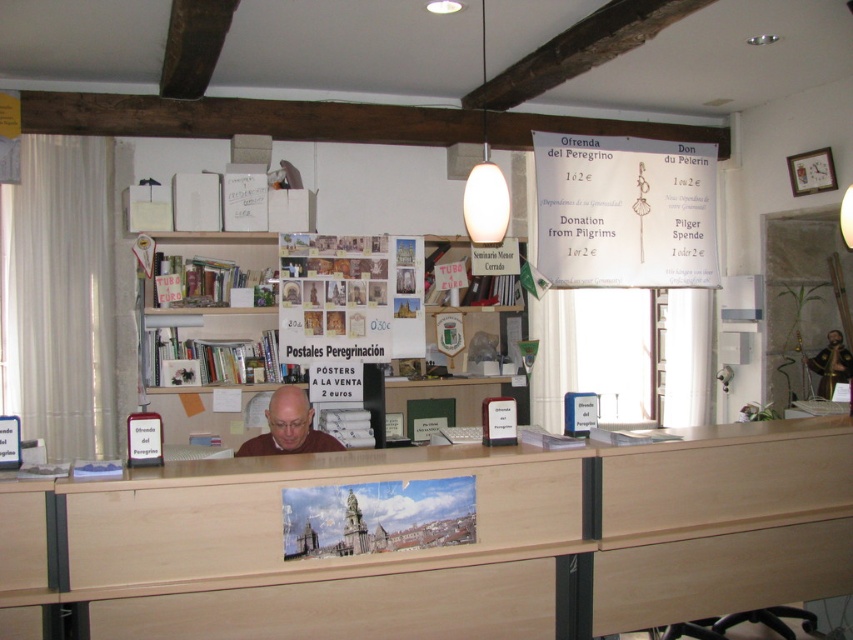
Does point (51, 552) come farther from viewer compared to point (44, 515)?

No, it is not.

Is light brown wood desk at center behind wooden drawer at lower left?

No, light brown wood desk at center is closer to the viewer.

Describe the element at coordinates (469, 545) in the screenshot. I see `light brown wood desk at center` at that location.

The image size is (853, 640). I want to click on light brown wood desk at center, so click(x=469, y=545).

Can you confirm if light brown wood desk at center is positioned to the right of wooden drawer at center?

Yes, light brown wood desk at center is to the right of wooden drawer at center.

Is point (590, 529) positioned before point (140, 518)?

No.

Where is `light brown wood desk at center`? The width and height of the screenshot is (853, 640). light brown wood desk at center is located at coordinates (469, 545).

Is wooden drawer at center to the left of white paper at upper center from the viewer's perspective?

Correct, you'll find wooden drawer at center to the left of white paper at upper center.

From the picture: Between wooden drawer at center and white paper at upper center, which one has more height?

white paper at upper center

The image size is (853, 640). I want to click on wooden drawer at center, so click(279, 520).